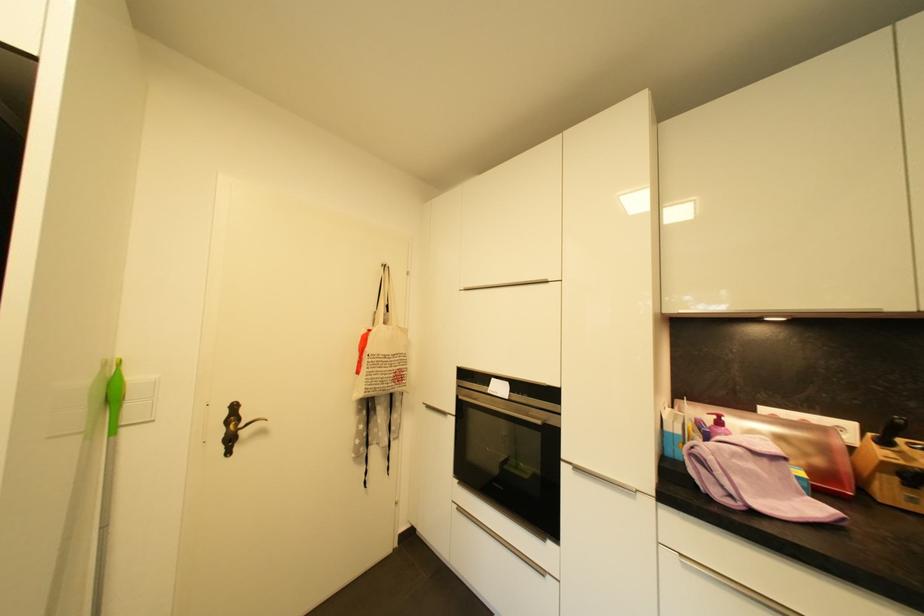
Where would you pull the black knife handle? Please return your answer as a coordinate pair (x, y).

(891, 431)